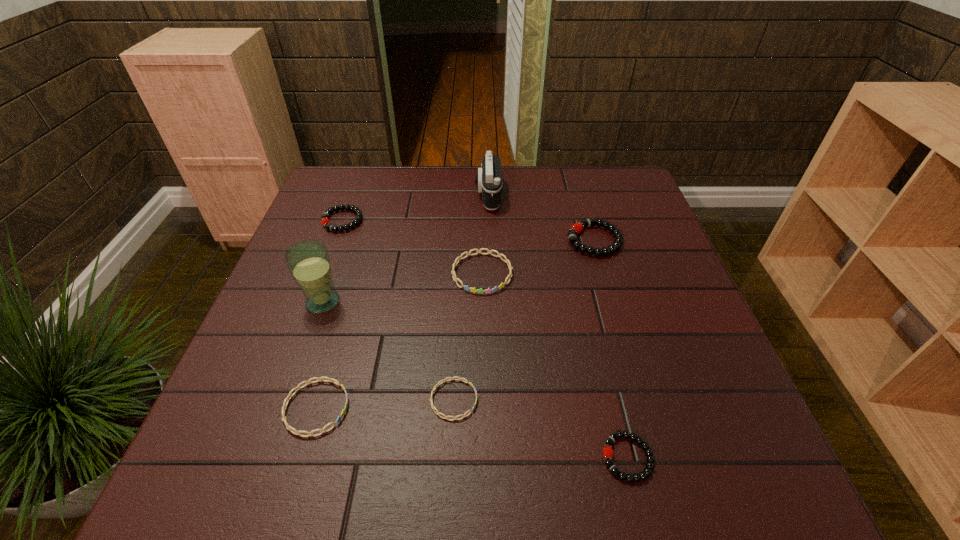
Image resolution: width=960 pixels, height=540 pixels. What are the coordinates of `blank space located 0.190m on the back of the blue glass` in the screenshot? It's located at (345, 238).

Locate an element on the screen. This screenshot has width=960, height=540. vacant area situated 0.370m on the front lens of the second tallest object is located at coordinates (352, 195).

Where is `free region located 0.080m on the front lens of the second tallest object`? free region located 0.080m on the front lens of the second tallest object is located at coordinates (448, 195).

Image resolution: width=960 pixels, height=540 pixels. In order to click on vacant space located on the front lens of the second tallest object in this screenshot , I will do `click(379, 195)`.

Identify the location of vacant region located on the front of the biggest black bracelet. (615, 312).

The width and height of the screenshot is (960, 540). Identify the location of vacant space located on the surface of the biggest blue bracelet showing star-shaped elements. (483, 389).

At what (x,y) coordinates should I click in order to perform the action: click on free space located on the right of the second smallest black bracelet. Please return your answer as a coordinate pair (x, y). This screenshot has height=540, width=960. Looking at the image, I should click on (434, 221).

Where is `vacant space located on the surface of the second biggest blue bracelet showing star-shaped elements`? vacant space located on the surface of the second biggest blue bracelet showing star-shaped elements is located at coordinates (541, 408).

This screenshot has height=540, width=960. Identify the location of vacant space located on the left of the smallest black bracelet. (527, 457).

This screenshot has width=960, height=540. I want to click on vacant space located on the surface of the shortest object showing star-shaped elements, so click(x=515, y=400).